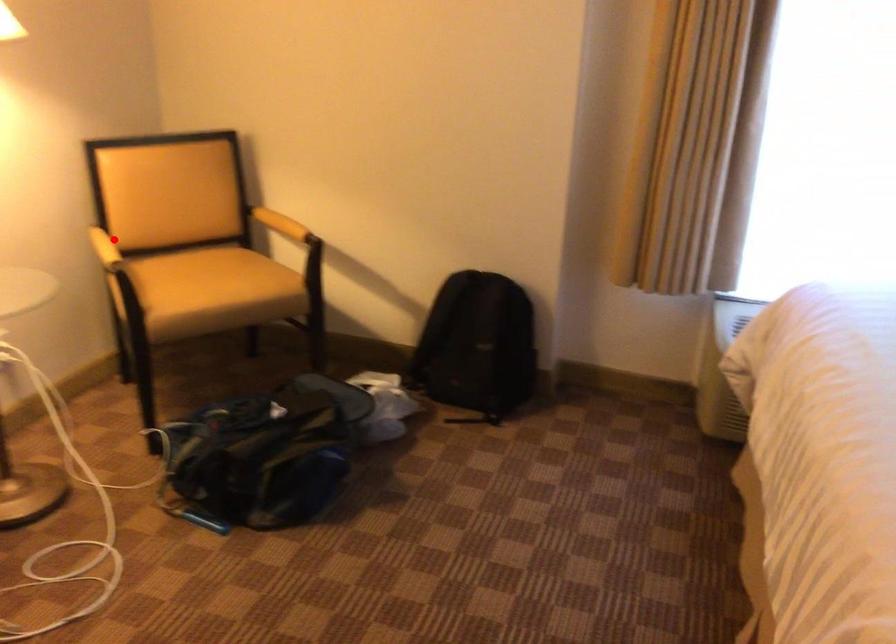
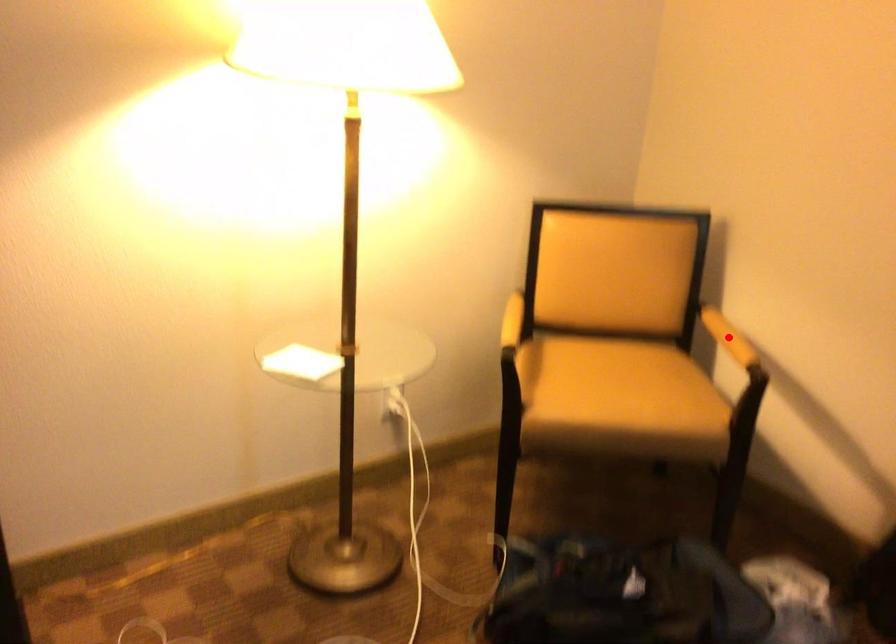
I am providing you with two images of the same scene from different viewpoints. A red point is marked on the first image and another point is marked on the second image. Are the points marked in image1 and image2 representing the same 3D position?

No